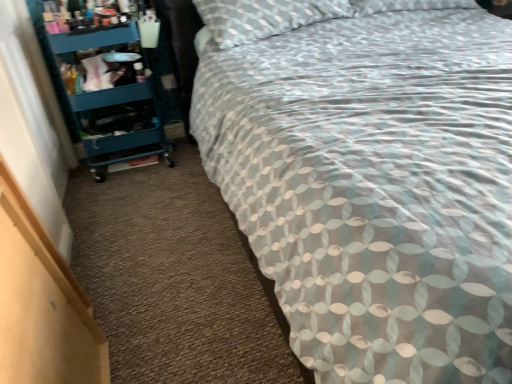
Question: Looking at their shapes, would you say teal plastic cart at left is wider or thinner than patterned fabric bed at center?

Choices:
 (A) wide
 (B) thin

Answer: (B)

Question: From a real-world perspective, is teal plastic cart at left positioned above or below patterned fabric bed at center?

Choices:
 (A) above
 (B) below

Answer: (B)

Question: Based on their sizes in the image, would you say teal plastic cart at left is bigger or smaller than patterned fabric bed at center?

Choices:
 (A) small
 (B) big

Answer: (A)

Question: From a real-world perspective, is patterned fabric bed at center positioned above or below teal plastic cart at left?

Choices:
 (A) below
 (B) above

Answer: (B)

Question: Is patterned fabric bed at center bigger or smaller than teal plastic cart at left?

Choices:
 (A) big
 (B) small

Answer: (A)

Question: From the image's perspective, relative to teal plastic cart at left, is patterned fabric bed at center above or below?

Choices:
 (A) below
 (B) above

Answer: (A)

Question: From their relative heights in the image, would you say patterned fabric bed at center is taller or shorter than teal plastic cart at left?

Choices:
 (A) short
 (B) tall

Answer: (B)